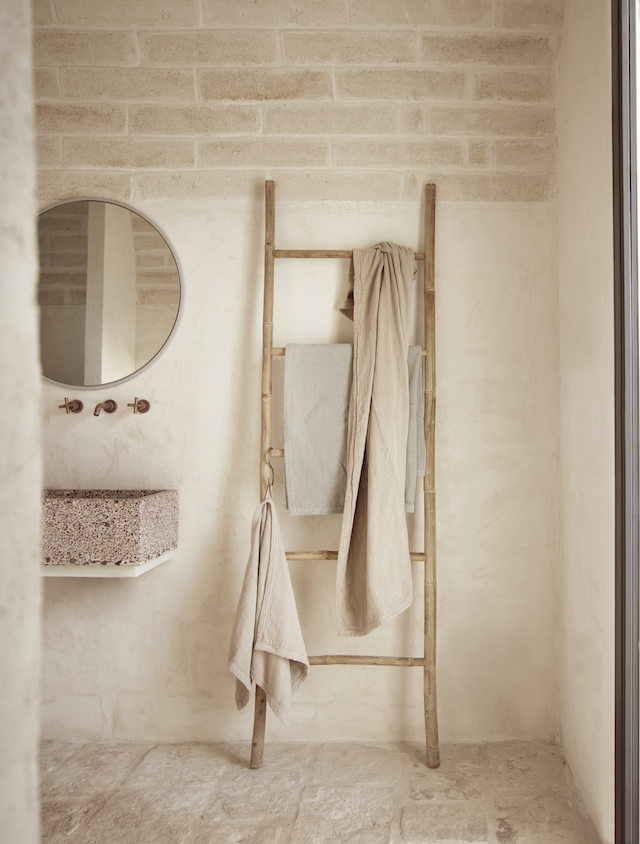
What are the coordinates of `towel` in the screenshot? It's located at (399, 307), (326, 398), (265, 571).